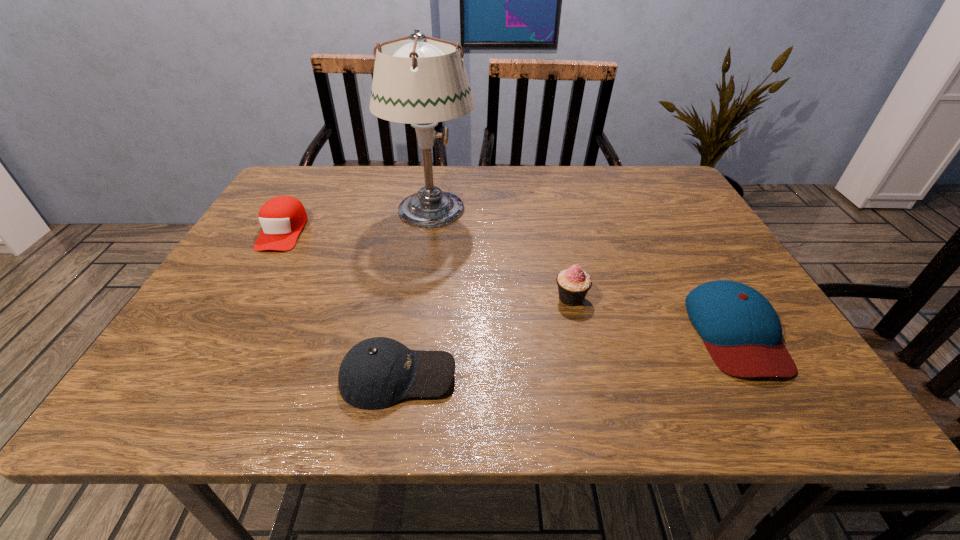
Find the location of `lampshade`. lampshade is located at coordinates (421, 82).

Where is `the second tallest object`? The height and width of the screenshot is (540, 960). the second tallest object is located at coordinates (573, 284).

The height and width of the screenshot is (540, 960). I want to click on the fourth object from left to right, so click(573, 284).

This screenshot has height=540, width=960. Identify the location of the leftmost baseball cap. (282, 218).

You are a GUI agent. You are given a task and a screenshot of the screen. Output one action in this format:
    pyautogui.click(x=<x>, y=<y>)
    Task: Click on the farthest baseball cap
    This screenshot has width=960, height=540.
    Given the screenshot: What is the action you would take?
    pyautogui.click(x=282, y=218)

Locate an element on the screen. Image resolution: width=960 pixels, height=540 pixels. the rightmost baseball cap is located at coordinates (741, 330).

Where is `the second baseball cap from right to left`? the second baseball cap from right to left is located at coordinates (376, 373).

Image resolution: width=960 pixels, height=540 pixels. In order to click on vacant area situated on the lampshade of the tallest object in this screenshot , I will do `click(498, 210)`.

Find the location of a particular element. vacant space located on the left of the fourth shortest object is located at coordinates (402, 298).

You are a GUI agent. You are given a task and a screenshot of the screen. Output one action in this format:
    pyautogui.click(x=<x>, y=<y>)
    Task: Click on the free space located on the front-facing side of the leftmost baseball cap
    
    Given the screenshot: What is the action you would take?
    pyautogui.click(x=251, y=287)